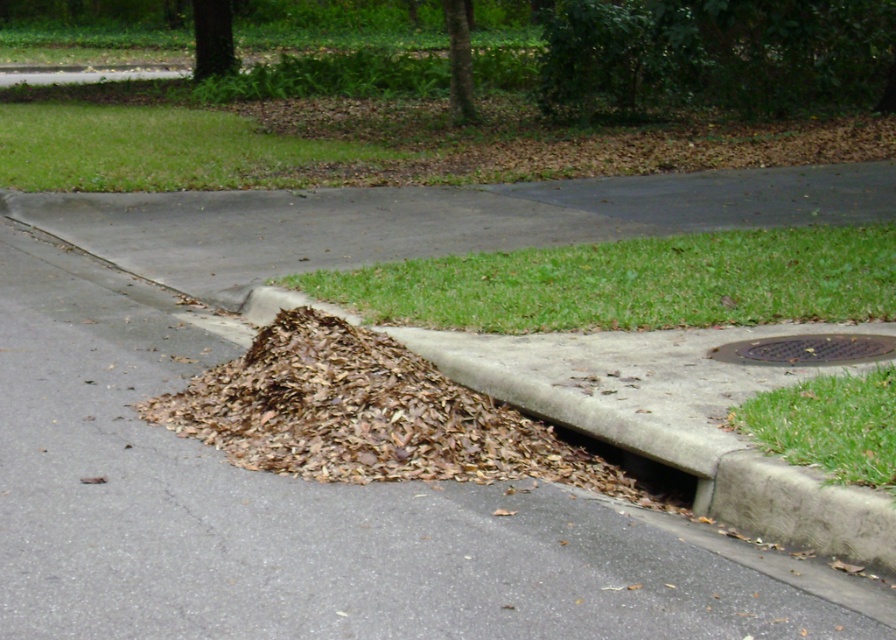
Question: Among these objects, which one is nearest to the camera?

Choices:
 (A) brown dried leaves at center
 (B) metallic grid manhole cover at lower right

Answer: (A)

Question: Does green grass at center appear on the left side of brown dried leaves at center?

Choices:
 (A) no
 (B) yes

Answer: (A)

Question: Does green grass at lower right appear on the right side of metallic grid manhole cover at lower right?

Choices:
 (A) yes
 (B) no

Answer: (B)

Question: Which of the following is the closest to the observer?

Choices:
 (A) (826, 387)
 (B) (711, 598)

Answer: (B)

Question: Which point appears farthest from the camera in this image?

Choices:
 (A) (343, 326)
 (B) (888, 339)
 (C) (817, 406)

Answer: (B)

Question: Can you confirm if green grass at upper center is thinner than green grass at center?

Choices:
 (A) no
 (B) yes

Answer: (A)